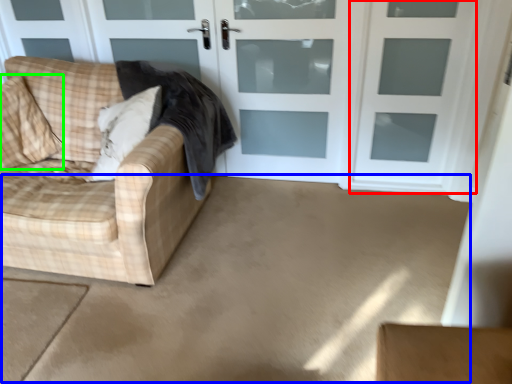
Question: Based on their relative distances, which object is farther from screen door (highlighted by a red box)? Choose from concrete (highlighted by a blue box) and pillow (highlighted by a green box).

Choices:
 (A) concrete
 (B) pillow

Answer: (B)